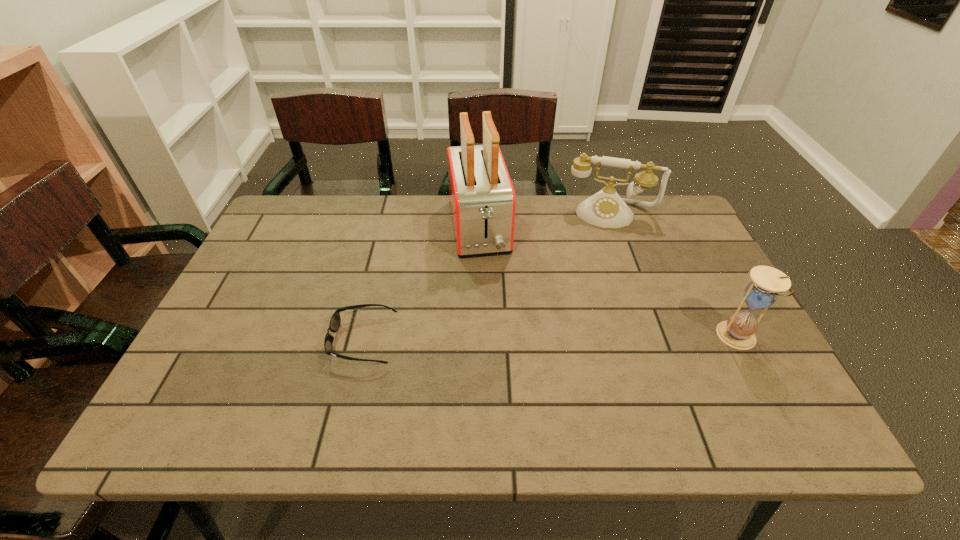
The width and height of the screenshot is (960, 540). I want to click on blank area in the image that satisfies the following two spatial constraints: 1. on the front side of the second object from right to left; 2. on the right side of the rightmost object, so click(656, 338).